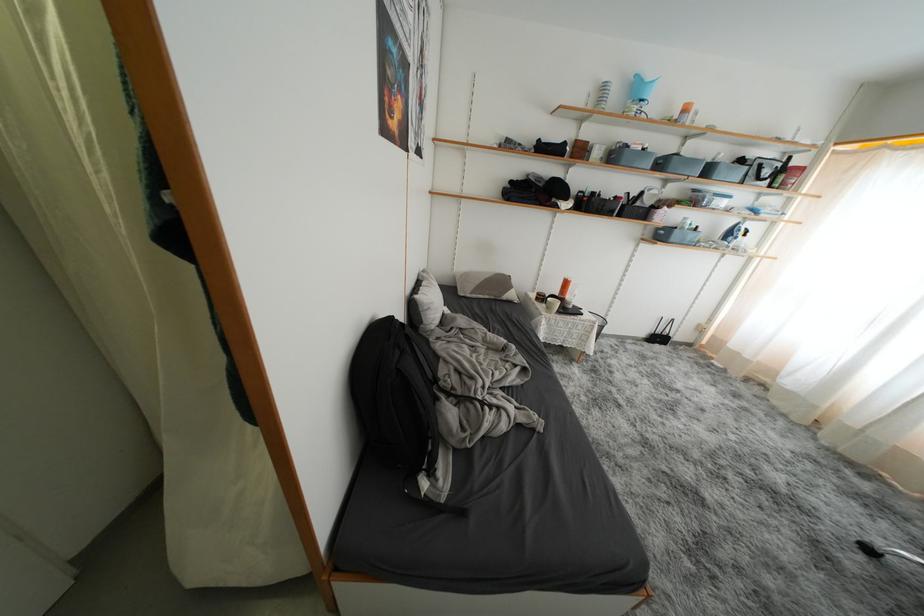
The width and height of the screenshot is (924, 616). What are the coordinates of `iron handle` in the screenshot? It's located at (886, 552).